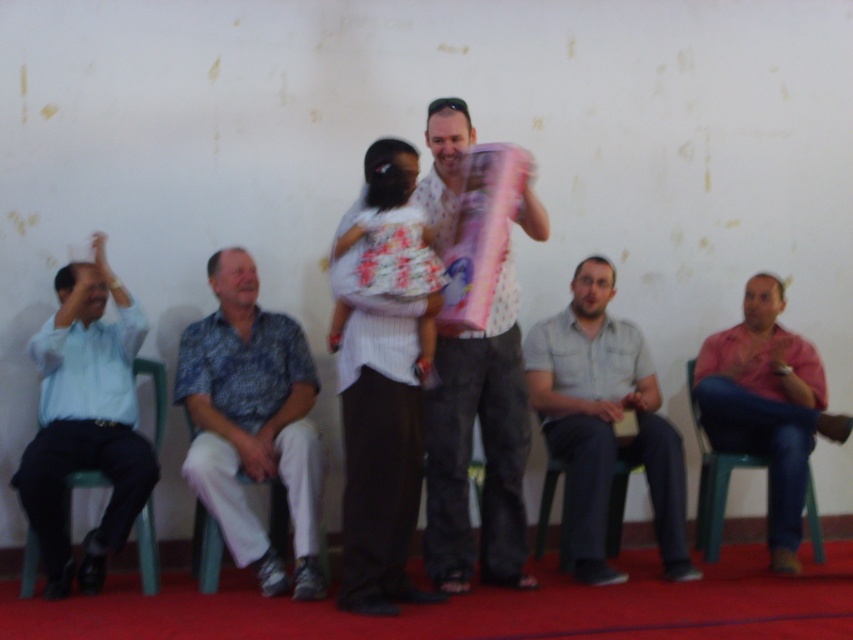
Question: Does white printed shirt at center lie in front of light blue shirt at left?

Choices:
 (A) no
 (B) yes

Answer: (B)

Question: Which of these objects is positioned closest to the white printed shirt at center?

Choices:
 (A) light blue shirt at left
 (B) green plastic chair at lower right
 (C) blue printed shirt at center

Answer: (C)

Question: Which object is the farthest from the white printed shirt at center?

Choices:
 (A) green plastic chair at lower center
 (B) light blue shirt at left

Answer: (B)

Question: Is white printed shirt at center positioned before green plastic chair at lower center?

Choices:
 (A) yes
 (B) no

Answer: (A)

Question: Which point is closer to the camera?

Choices:
 (A) green plastic chair at lower right
 (B) floral fabric dress at center
 (C) light blue shirt at left

Answer: (B)

Question: Is gray cotton shirt at center to the left of green plastic chair at lower right from the viewer's perspective?

Choices:
 (A) no
 (B) yes

Answer: (B)